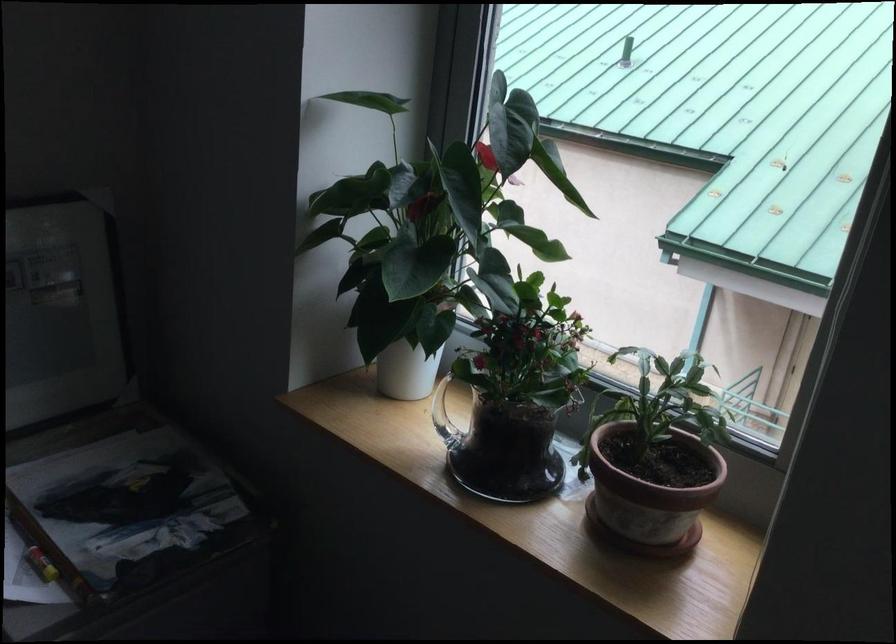
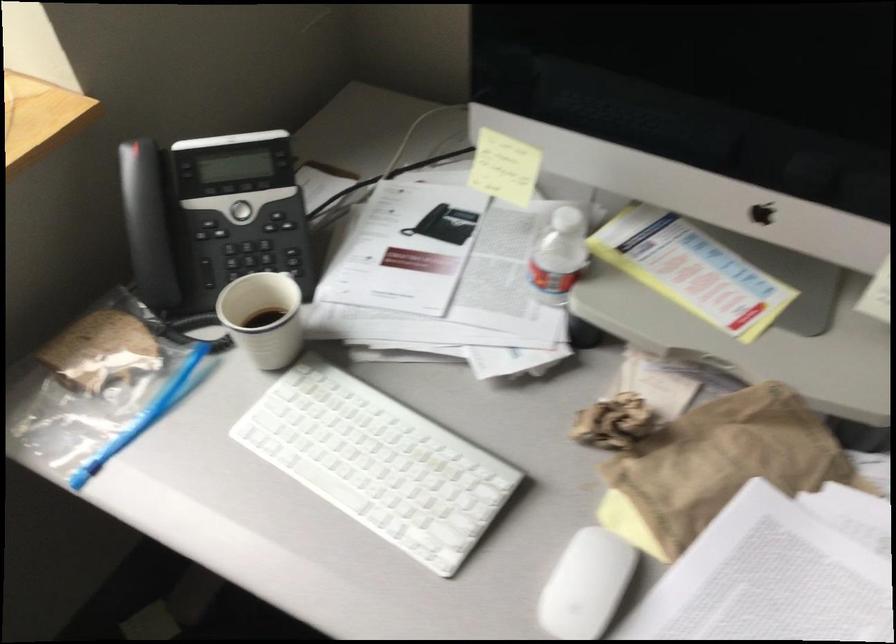
First-person continuous shooting, in which direction is the camera rotating?

The camera's rotation is toward right-down.